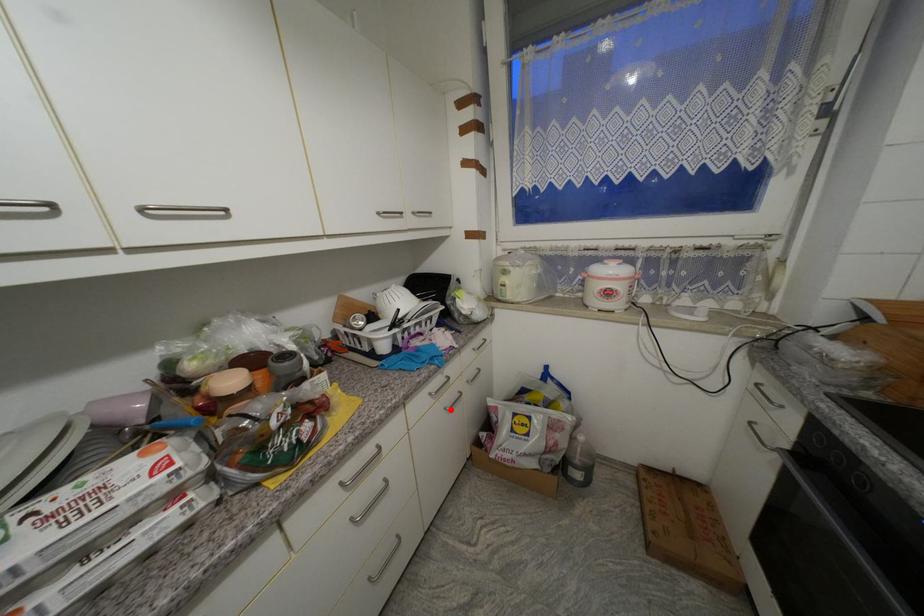
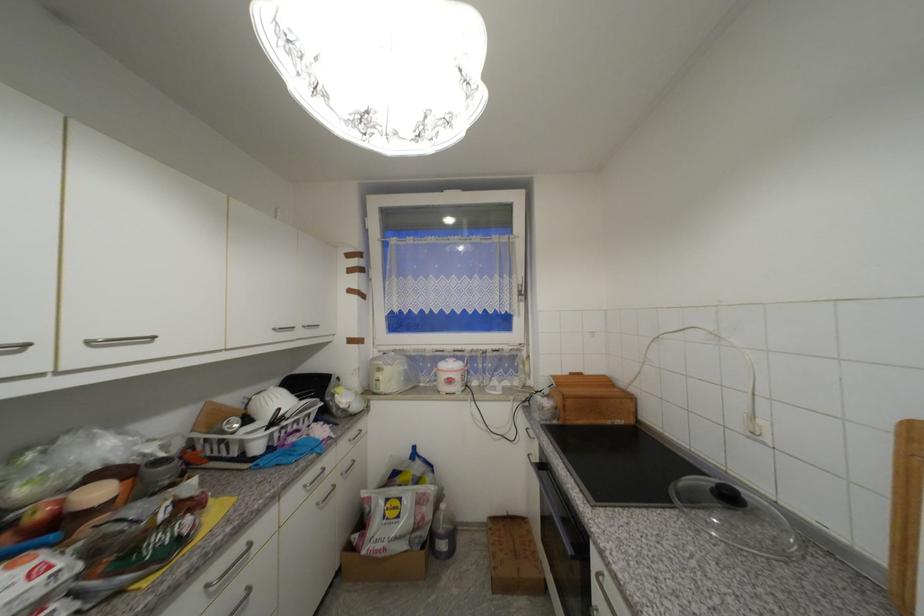
Question: I am providing you with two images of the same scene from different viewpoints. Image1 has a red point marked. In image2, the corresponding 3D location appears at what relative position? Reply with the corresponding letter.

Choices:
 (A) Closer
 (B) Farther

Answer: (A)